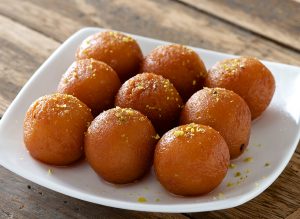
Identify the location of dark wood. Image resolution: width=300 pixels, height=219 pixels. (120, 18), (30, 49).